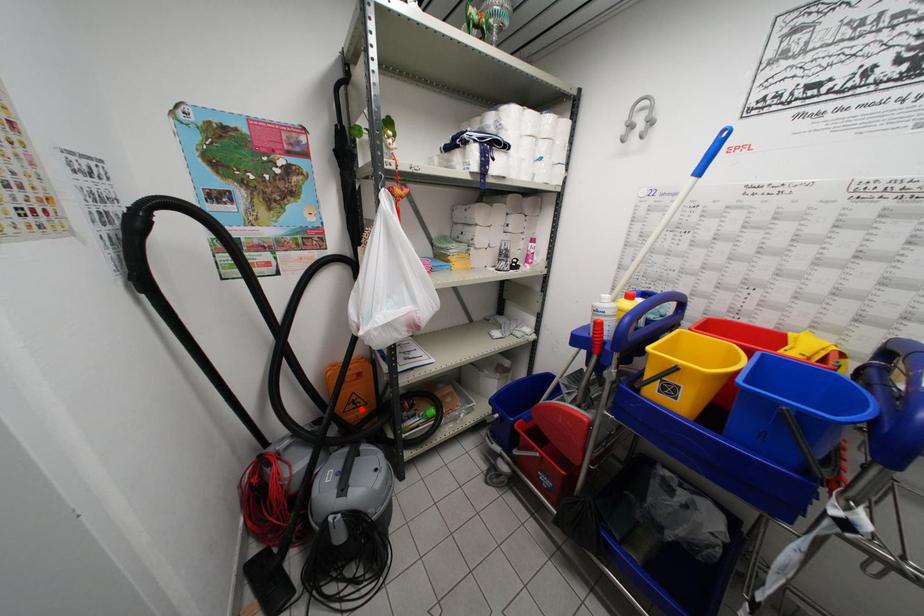
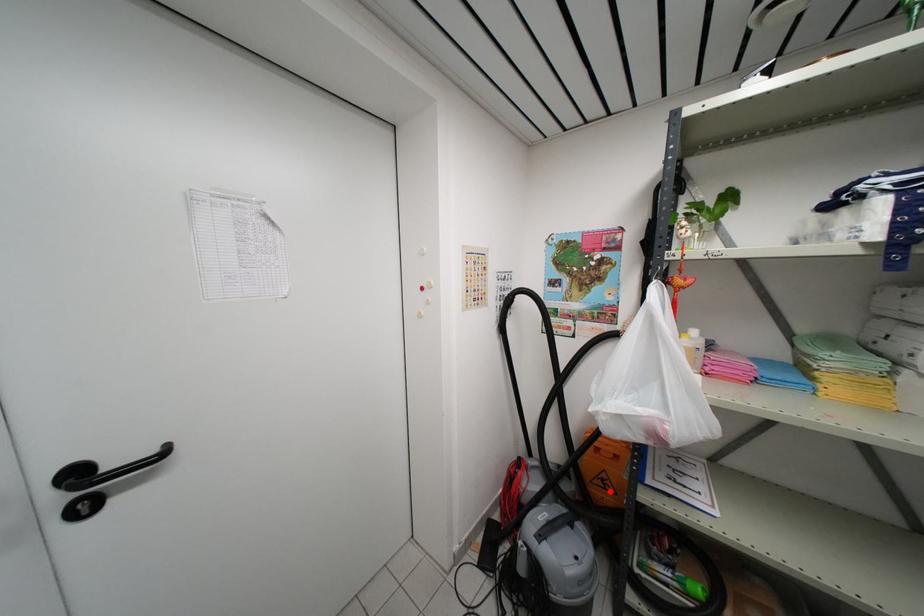
I am providing you with two images of the same scene from different viewpoints. A red point is marked on the first image and another point is marked on the second image. Is the red point in image1 aligned with the point shown in image2?

Yes